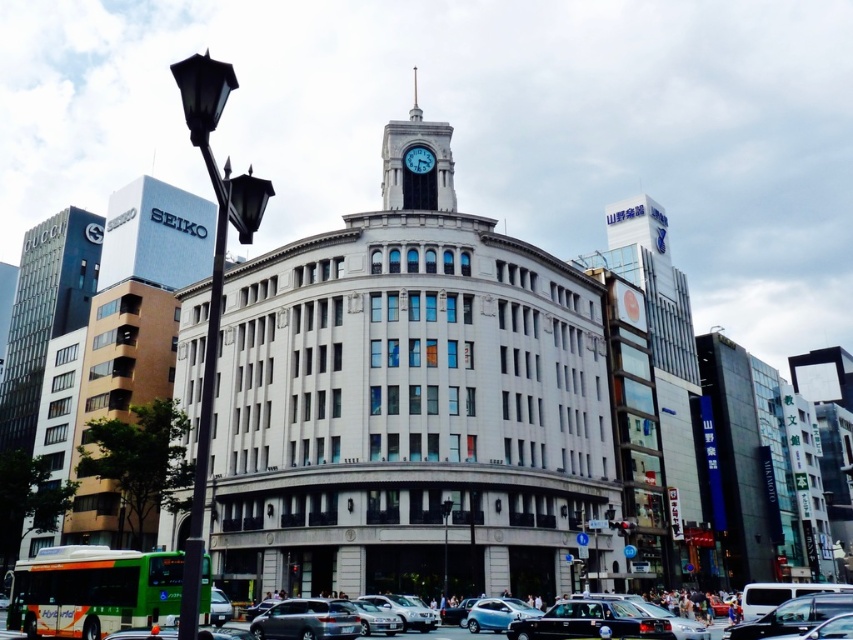
You are a city planner evaluating the urban layout. Considering the white stone clock tower at upper center and the metallic silver sedan at center, which object would cast a longer shadow during midday? Please explain your reasoning based on their positions and sizes.

The white stone clock tower at upper center would cast a longer shadow than the metallic silver sedan at center because it is much taller, and taller objects typically cast longer shadows when the sun is at a lower angle. However, midday shadows are shorter due to the sun being overhead, but the height difference between the two objects still means the clock tower would have a longer shadow.

You are standing on the sidewalk in front of the historic building and want to cross the street to reach the metallic silver car at center. The crosswalk is 100 feet long. Can you safely reach the car before the crosswalk ends?

The metallic silver car at center is 107.19 feet away from the viewer. Since the crosswalk is only 100 feet long, you cannot safely reach the car before the crosswalk ends.

You are a delivery driver who needs to park your vehicle in a parking spot that has a height restriction of 1.8 meters. You have a silver metallic van at center and a metallic silver car at center. Which vehicle should you choose to park there?

The silver metallic van at center has a lesser height compared to the metallic silver car at center. Therefore, the silver metallic van at center is more likely to comply with the 1.8 meters height restriction and should be chosen for parking.